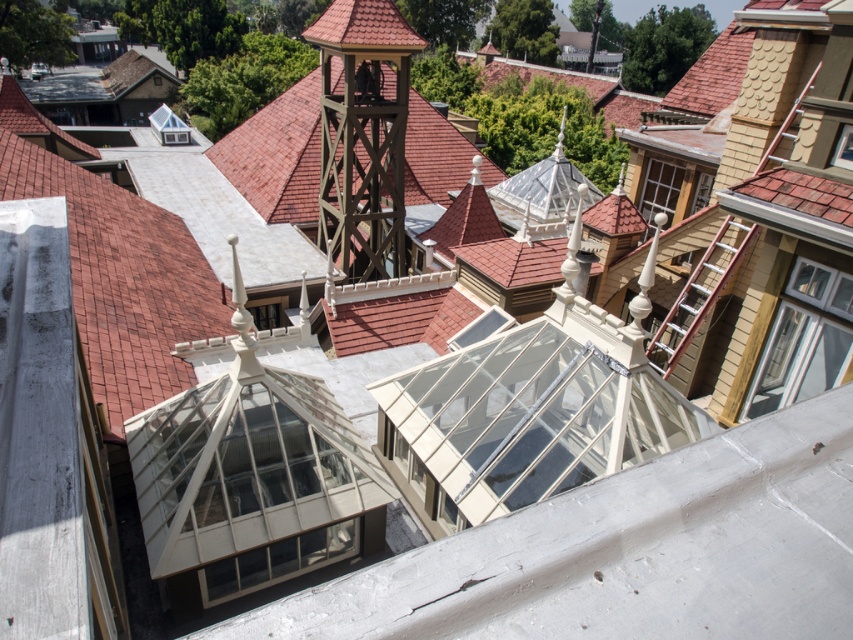
You are an architect reviewing a model of a historical building complex. You notice the wooden bell tower at center and the wooden ladder at upper right. Based on their positions, which object is closer to the right edge of the model?

The wooden ladder at upper right is closer to the right edge of the model because it is positioned to the right of the wooden bell tower at center.

You are a maintenance worker needing to reach the wooden bell tower at center for repairs. There is a wooden ladder at upper right. Can you use the ladder to reach the bell tower from your current position?

The wooden bell tower at center is 12.59 meters away from the wooden ladder at upper right. Since ladders typically are not that long, you cannot reach the bell tower using the ladder at that distance.

Consider the image. You are standing at the point marked by the coordinates point at (363, 134) in the image. Which building are you currently located in?

You are located in the wooden bell tower at center, as the point at (363, 134) represents its position in the image.